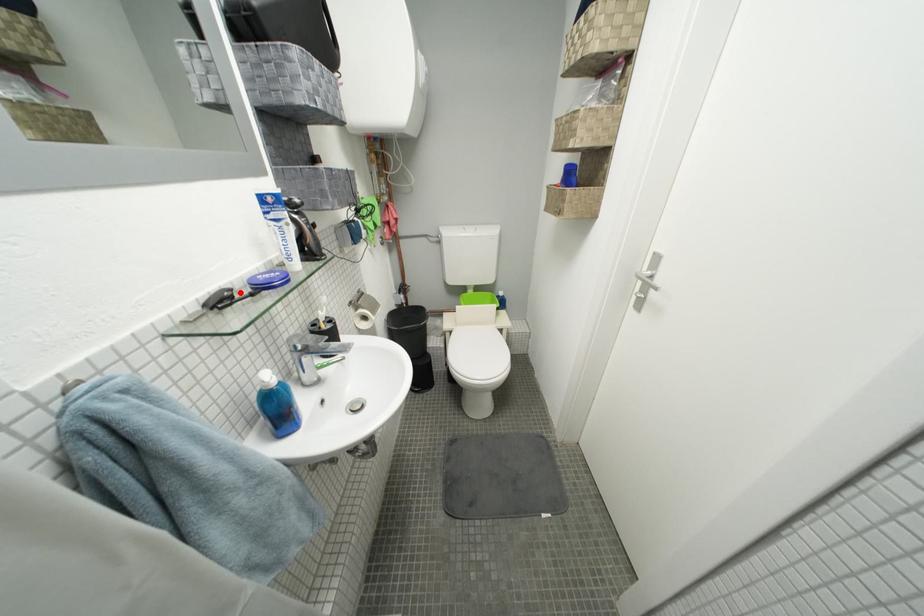
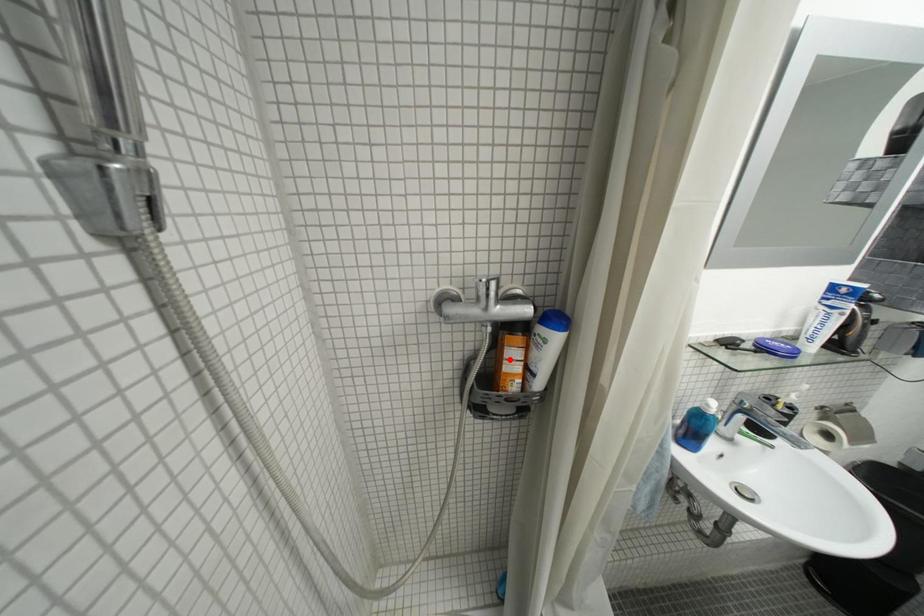
I am providing you with two images of the same scene from different viewpoints. A red point is marked on the first image and another point is marked on the second image. Do the highlighted points in image1 and image2 indicate the same real-world spot?

No